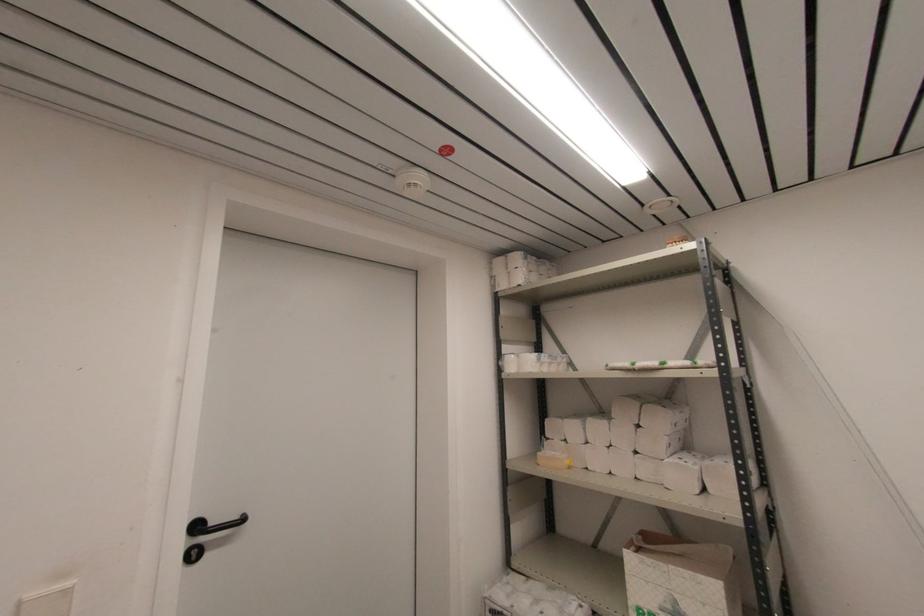
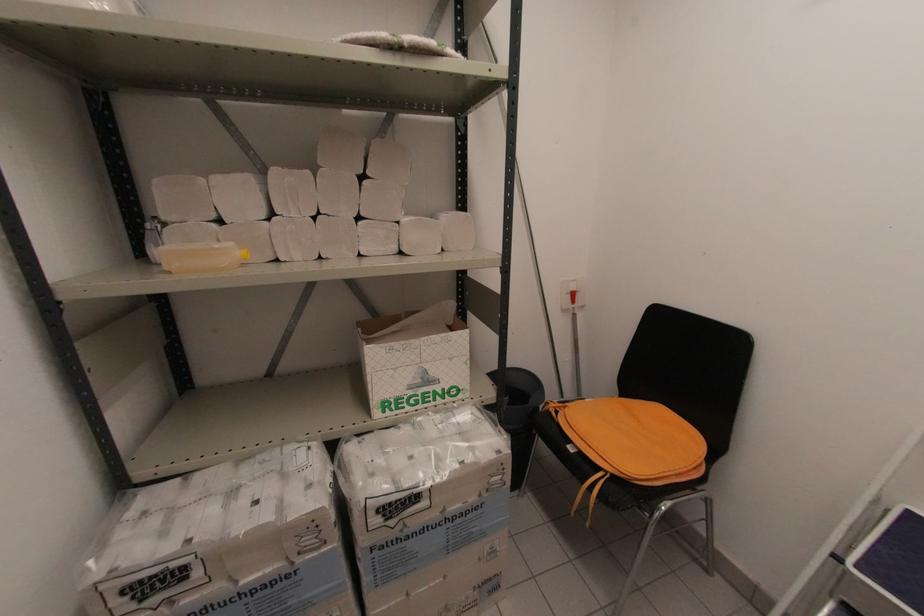
The first image is from the beginning of the video and the second image is from the end. How did the camera likely rotate when shooting the video?

The camera's rotation is toward right-down.